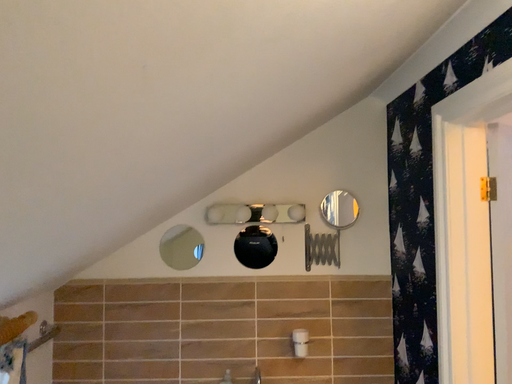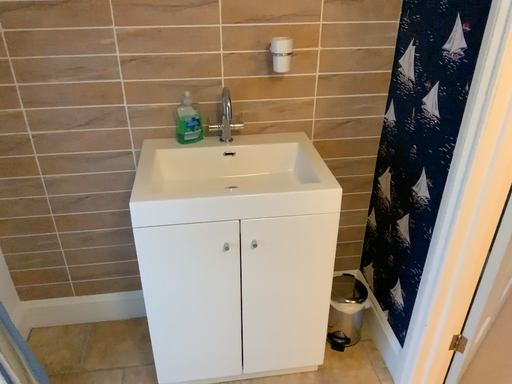
Question: How did the camera likely rotate when shooting the video?

Choices:
 (A) rotated downward
 (B) rotated upward

Answer: (A)